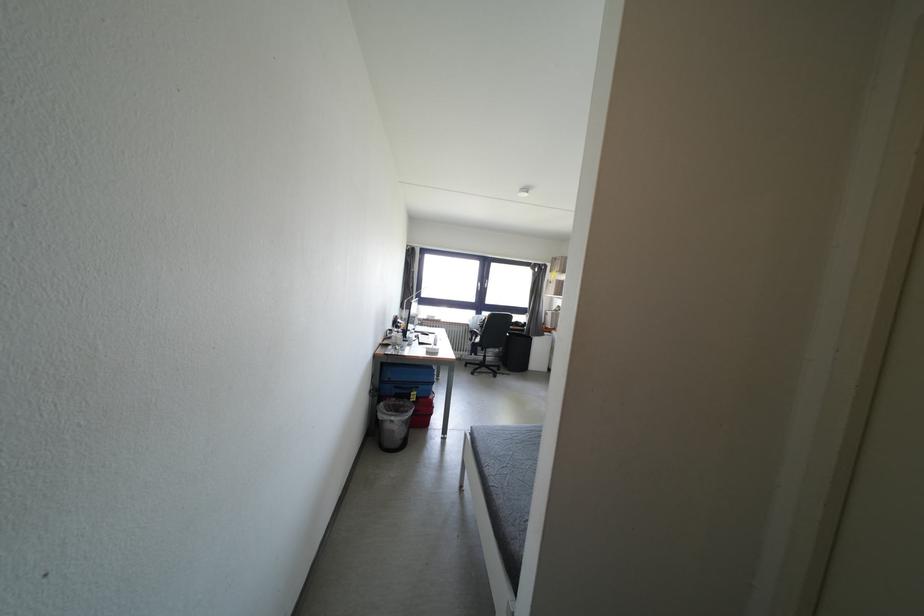
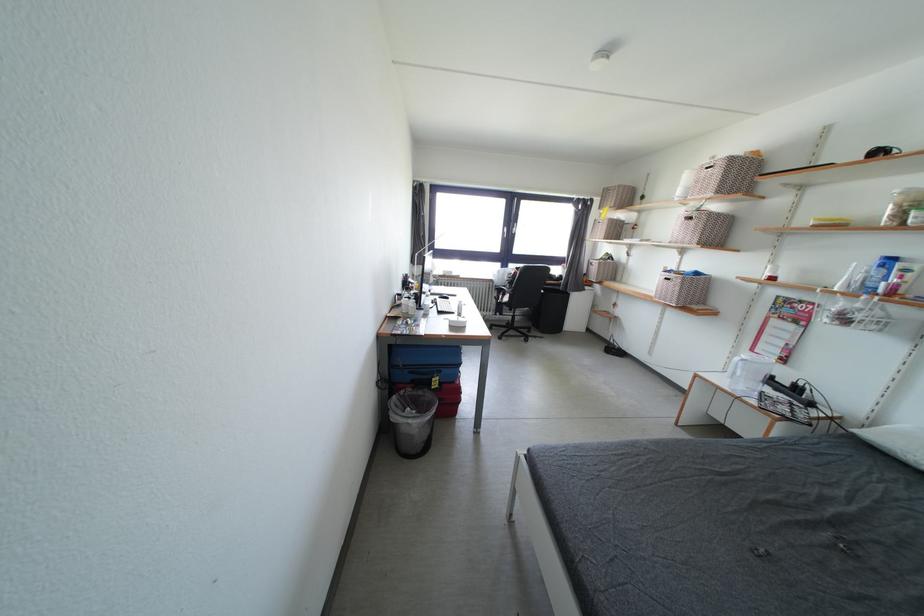
The point at (424,392) is marked in the first image. Where is the corresponding point in the second image?

(446, 377)